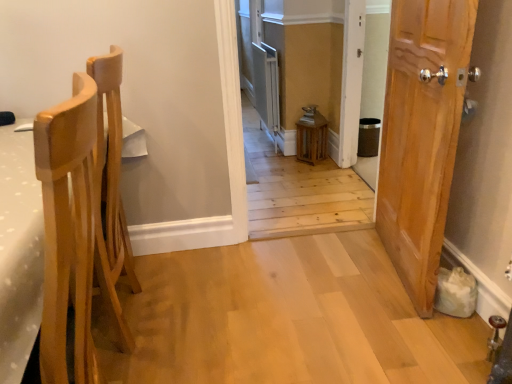
Question: From a real-world perspective, is light wood chair at left positioned under wooden lantern at center based on gravity?

Choices:
 (A) no
 (B) yes

Answer: (B)

Question: Can wooden lantern at center be found inside light wood chair at left?

Choices:
 (A) yes
 (B) no

Answer: (B)

Question: Is light wood chair at left beside wooden lantern at center?

Choices:
 (A) yes
 (B) no

Answer: (B)

Question: From the image's perspective, would you say light wood chair at left is positioned over wooden lantern at center?

Choices:
 (A) yes
 (B) no

Answer: (B)

Question: From the image's perspective, would you say light wood chair at left is shown under wooden lantern at center?

Choices:
 (A) yes
 (B) no

Answer: (A)

Question: Is light wood chair at left situated inside wooden lantern at center or outside?

Choices:
 (A) outside
 (B) inside

Answer: (A)

Question: Is light wood chair at left taller or shorter than wooden lantern at center?

Choices:
 (A) tall
 (B) short

Answer: (B)

Question: Is point (95, 269) closer or farther from the camera than point (296, 23)?

Choices:
 (A) farther
 (B) closer

Answer: (B)

Question: From a real-world perspective, relative to wooden lantern at center, is light wood chair at left vertically above or below?

Choices:
 (A) below
 (B) above

Answer: (A)

Question: Considering the positions of point (397, 3) and point (84, 84), is point (397, 3) closer or farther from the camera than point (84, 84)?

Choices:
 (A) farther
 (B) closer

Answer: (A)

Question: Is wooden door at right wider or thinner than light wood chair at left?

Choices:
 (A) wide
 (B) thin

Answer: (B)

Question: From the image's perspective, is wooden door at right above or below light wood chair at left?

Choices:
 (A) above
 (B) below

Answer: (A)

Question: Considering the positions of wooden door at right and light wood chair at left in the image, is wooden door at right taller or shorter than light wood chair at left?

Choices:
 (A) tall
 (B) short

Answer: (A)

Question: From the image's perspective, relative to wooden lantern at center, is wooden door at right above or below?

Choices:
 (A) above
 (B) below

Answer: (B)

Question: Is wooden door at right inside or outside of wooden lantern at center?

Choices:
 (A) inside
 (B) outside

Answer: (B)